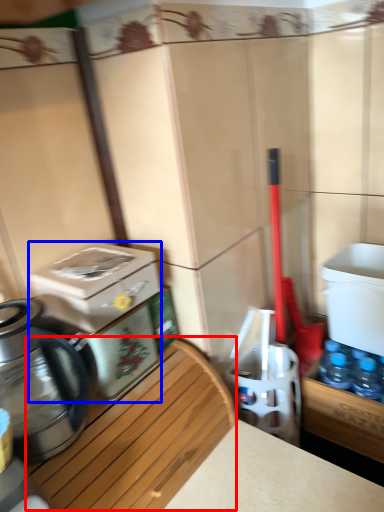
Question: Which object is closer to the camera taking this photo, wood (highlighted by a red box) or water cooler (highlighted by a blue box)?

Choices:
 (A) wood
 (B) water cooler

Answer: (A)